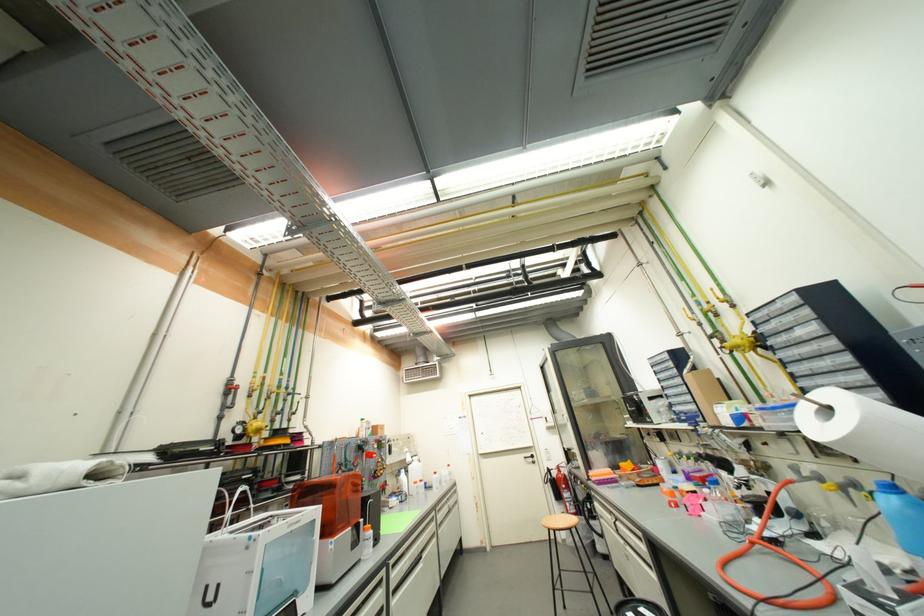
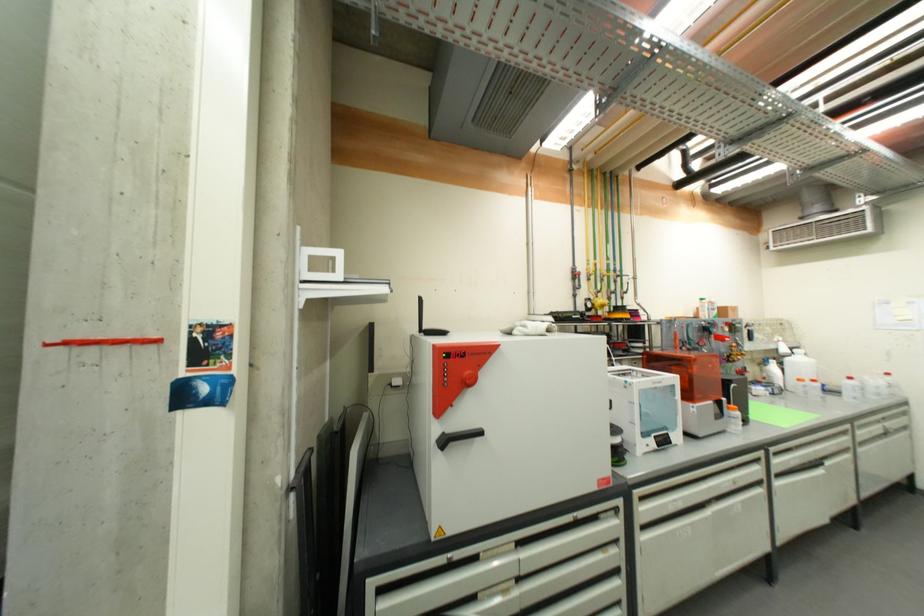
In the second image, find the point that corresponds to pixel 441 475 in the first image.

(856, 379)